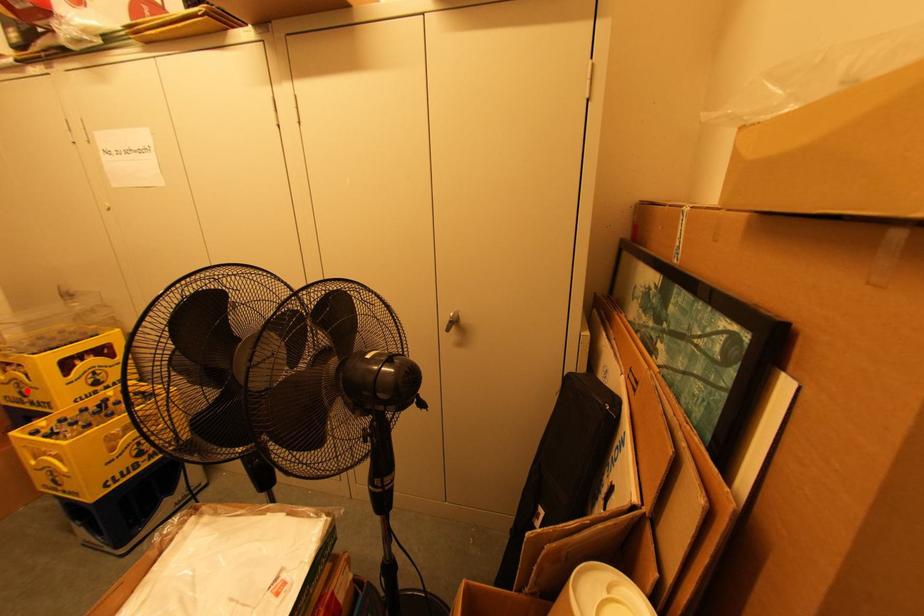
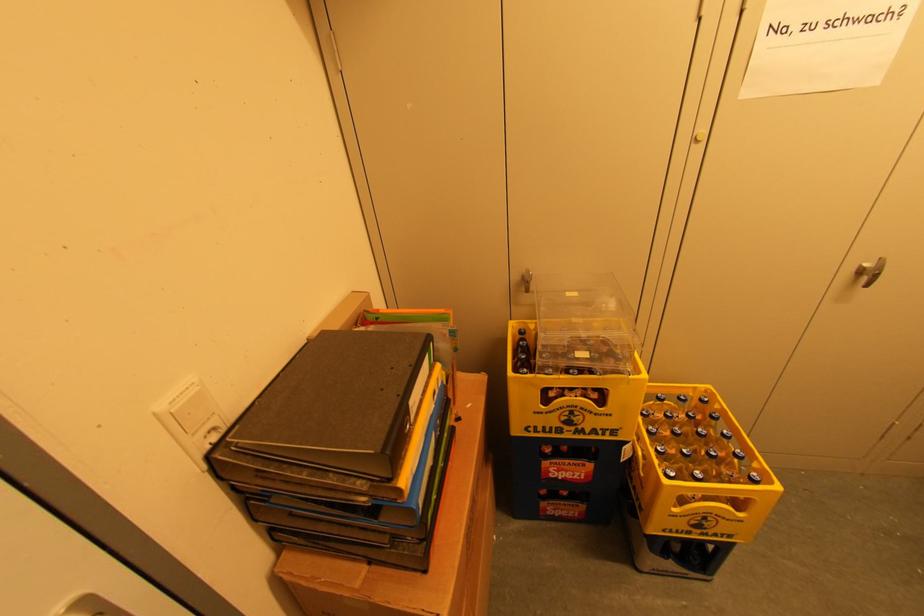
Question: I am providing you with two images of the same scene from different viewpoints. A red point is marked on the first image. At the location where the point appears in image 1, is it still visible in image 2?

Choices:
 (A) Yes
 (B) No

Answer: (A)